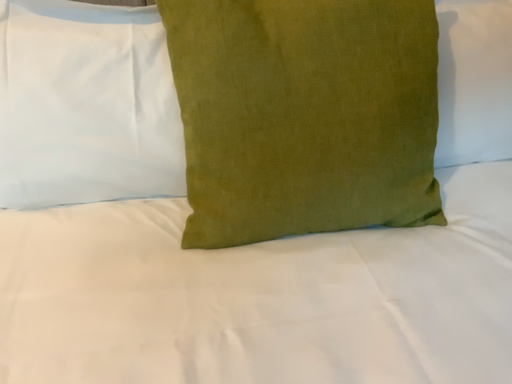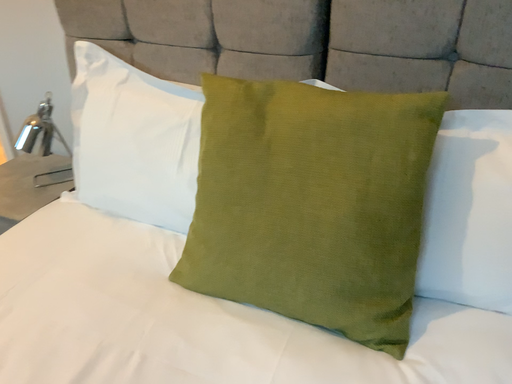
Question: How did the camera likely rotate when shooting the video?

Choices:
 (A) rotated right
 (B) rotated left

Answer: (B)